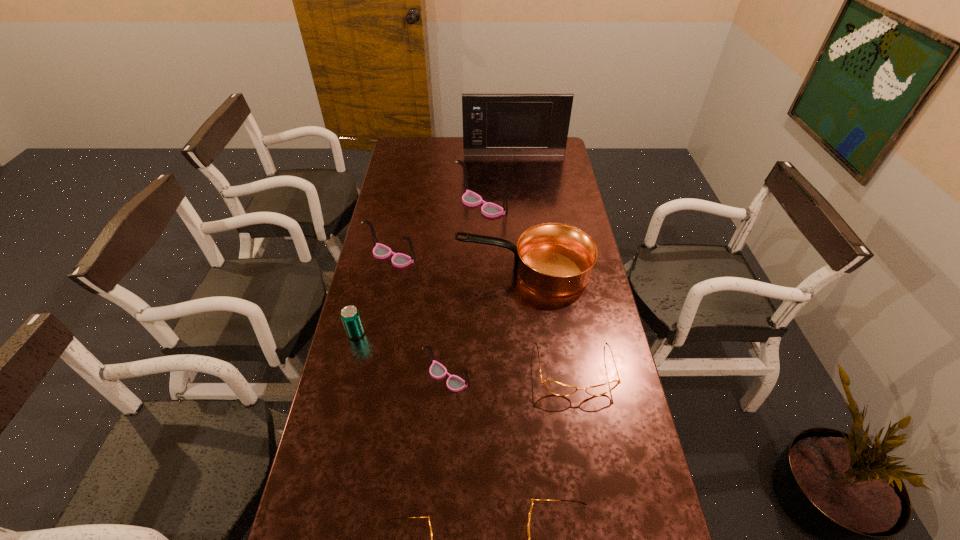
Locate an element on the screen. The image size is (960, 540). vacant region located 0.320m on the front of the teal beer can is located at coordinates (330, 438).

Where is `free space located 0.050m on the front-facing side of the seventh tallest object`? Image resolution: width=960 pixels, height=540 pixels. free space located 0.050m on the front-facing side of the seventh tallest object is located at coordinates (582, 415).

Identify the location of object positioned at the far edge. Image resolution: width=960 pixels, height=540 pixels. (494, 124).

The image size is (960, 540). Find the location of `spectacles that is at the left edge`. spectacles that is at the left edge is located at coordinates (380, 251).

I want to click on beer can present at the left edge, so click(x=350, y=316).

Where is `microwave oven present at the right edge`? microwave oven present at the right edge is located at coordinates (494, 124).

Find the location of `frying pan present at the right edge`. frying pan present at the right edge is located at coordinates (555, 259).

Where is `spectacles that is at the right edge`? The image size is (960, 540). spectacles that is at the right edge is located at coordinates (553, 387).

Identify the location of object that is positioned at the far right corner. (494, 124).

I want to click on blank area at the far edge, so click(x=432, y=157).